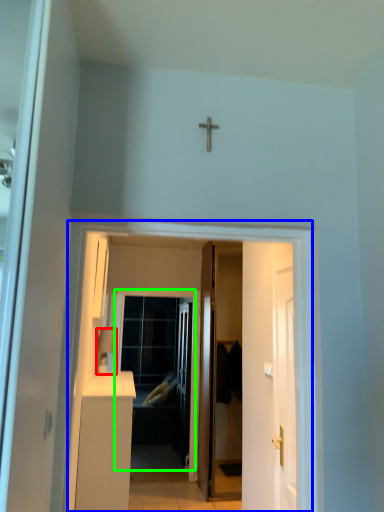
Question: Based on their relative distances, which object is farther from lamp (highlighted by a red box)? Choose from corridor (highlighted by a blue box) and screen door (highlighted by a green box).

Choices:
 (A) corridor
 (B) screen door

Answer: (B)